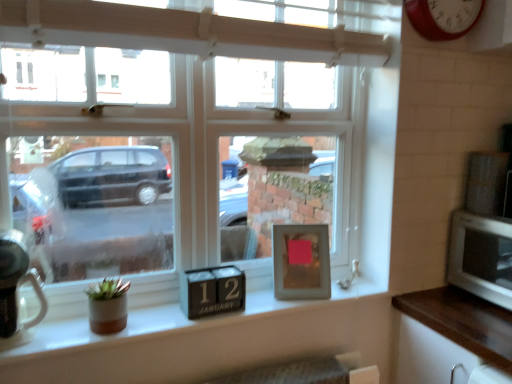
Question: In the image, is clear glass window at center positioned in front of or behind brown wood counter top at lower right?

Choices:
 (A) front
 (B) behind

Answer: (A)

Question: Is clear glass window at center taller or shorter than brown wood counter top at lower right?

Choices:
 (A) short
 (B) tall

Answer: (B)

Question: Which object is the farthest from the silver metallic microwave at right?

Choices:
 (A) red metallic clock at upper right
 (B) white glossy microwave at right, the second appliance from the left
 (C) brown wood counter top at lower right
 (D) brushed metal kettle at left, which ranks as the 2th appliance in top-to-bottom order
 (E) clear glass window at center

Answer: (D)

Question: Which object is the farthest from the white glossy microwave at right, the 2th appliance positioned from the bottom?

Choices:
 (A) silver metallic microwave at right
 (B) clear glass window at center
 (C) red metallic clock at upper right
 (D) brushed metal kettle at left, arranged as the first appliance when ordered from the bottom
 (E) brown wood counter top at lower right

Answer: (D)